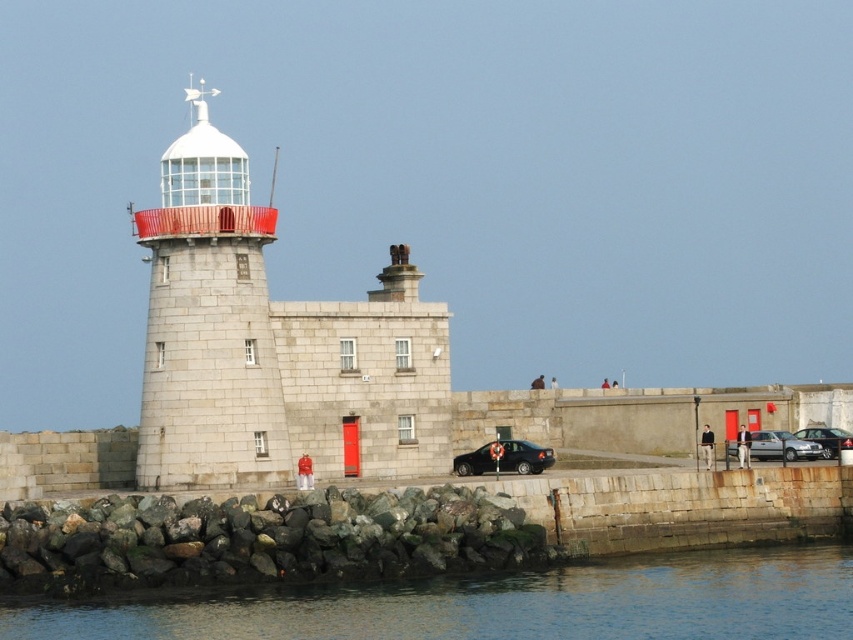
Who is more distant from viewer, (363, 506) or (824, 449)?

The point (824, 449) is more distant.

Where is `green mossy rock at lower center`? The image size is (853, 640). green mossy rock at lower center is located at coordinates (260, 540).

Who is lower down, green mossy rock at lower center or silver metallic sedan at right?

green mossy rock at lower center is lower down.

Can you confirm if green mossy rock at lower center is smaller than silver metallic sedan at right?

No, green mossy rock at lower center is not smaller than silver metallic sedan at right.

Does point (68, 572) lie in front of point (807, 456)?

That is True.

Identify the location of green mossy rock at lower center. The image size is (853, 640). (260, 540).

Between point (294, 554) and point (541, 458), which one is positioned in front?

Point (294, 554) is more forward.

Is green mossy rock at lower center smaller than black matte sedan at center?

Incorrect, green mossy rock at lower center is not smaller in size than black matte sedan at center.

The image size is (853, 640). I want to click on green mossy rock at lower center, so click(x=260, y=540).